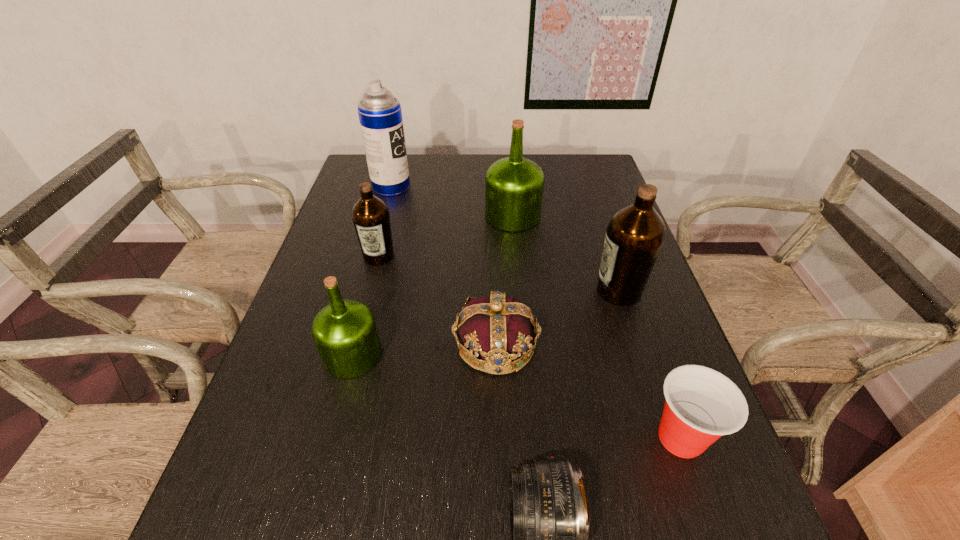
In order to click on crown in this screenshot , I will do `click(502, 330)`.

Locate an element on the screen. Image resolution: width=960 pixels, height=540 pixels. cup is located at coordinates (701, 405).

The image size is (960, 540). Identify the location of red cup. (701, 405).

Find the location of a particular element. The height and width of the screenshot is (540, 960). free location located 0.050m on the label side of the farthest object is located at coordinates (425, 186).

In order to click on free region located 0.250m on the left of the bigger green olive oil in this screenshot , I will do `click(403, 216)`.

What are the coordinates of `free space located on the label of the bigger brown olive oil` in the screenshot? It's located at (518, 291).

What are the coordinates of `vacant space located 0.050m on the label of the bigger brown olive oil` in the screenshot? It's located at (574, 291).

Identify the location of free space located 0.080m on the label of the bigger brown olive oil. (563, 291).

This screenshot has height=540, width=960. I want to click on free point located on the label of the left brown olive oil, so click(371, 288).

You are a GUI agent. You are given a task and a screenshot of the screen. Output one action in this format:
    pyautogui.click(x=<x>, y=<y>)
    Task: Click on the vacant space located 0.090m on the right of the nearest olive oil
    The width and height of the screenshot is (960, 540).
    Given the screenshot: What is the action you would take?
    pyautogui.click(x=422, y=355)